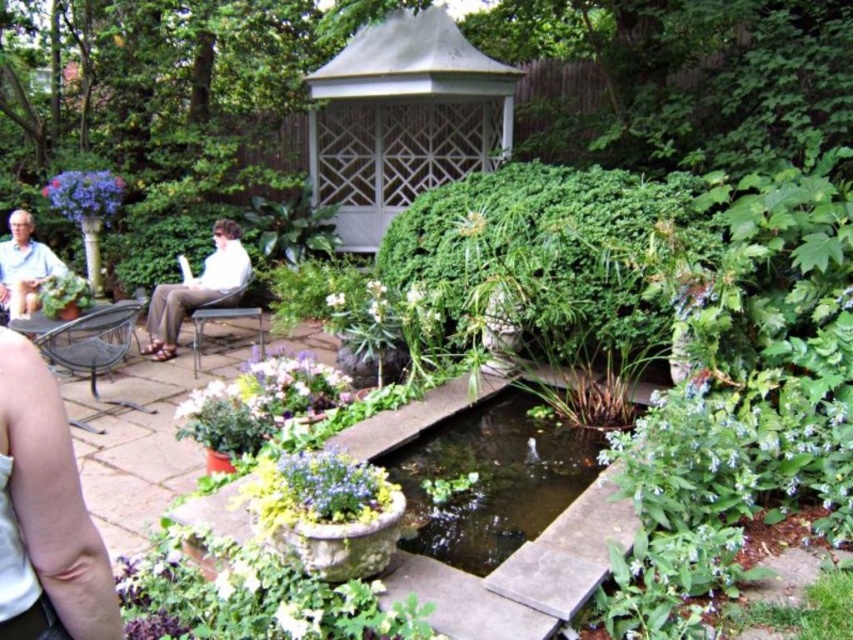
Can you confirm if smooth white arm at lower left is wider than matte purple flowers at center?

No.

Between point (100, 595) and point (341, 477), which one is positioned in front?

Positioned in front is point (100, 595).

Who is more distant from viewer, [73,628] or [346,502]?

Positioned behind is point [346,502].

Locate an element on the screen. The image size is (853, 640). smooth white arm at lower left is located at coordinates pyautogui.click(x=45, y=504).

Measure the distance between point (24, 228) and camera.

Point (24, 228) is 6.58 meters away from camera.

Is light blue shirt at upper left to the right of white matte flower at center from the viewer's perspective?

Incorrect, light blue shirt at upper left is not on the right side of white matte flower at center.

Who is more distant from viewer, (10, 268) or (340, 307)?

Positioned behind is point (10, 268).

At what (x,y) coordinates should I click in order to perform the action: click on light blue shirt at upper left. Please return your answer as a coordinate pair (x, y). Looking at the image, I should click on (24, 266).

Describe the element at coordinates (45, 504) in the screenshot. I see `smooth white arm at lower left` at that location.

Between point (32, 609) and point (50, 252), which one is positioned in front?

Point (32, 609) is in front.

Locate an element on the screen. The width and height of the screenshot is (853, 640). smooth white arm at lower left is located at coordinates (45, 504).